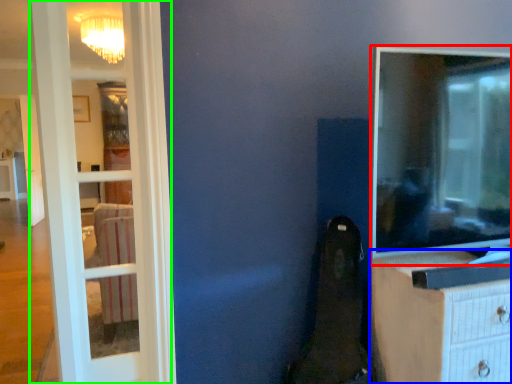
Question: Which is nearer to the tv show (highlighted by a red box)? chest of drawers (highlighted by a blue box) or door (highlighted by a green box).

Choices:
 (A) chest of drawers
 (B) door

Answer: (A)